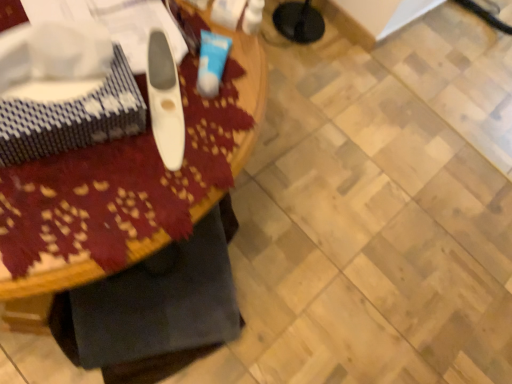
Question: Should I look upward or downward to see wooden table at center?

Choices:
 (A) up
 (B) down

Answer: (A)